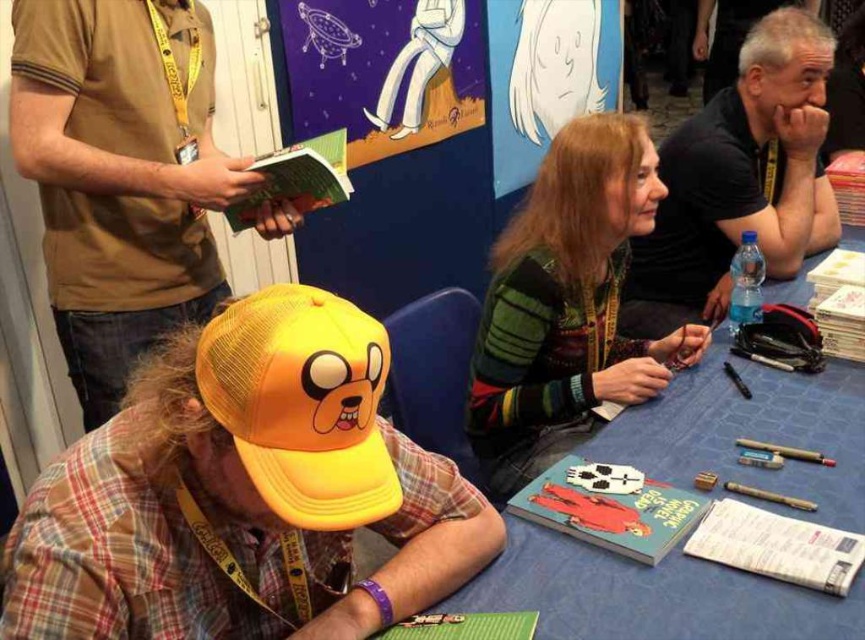
Looking at this image, which of these two, blue fabric table at center or matte plastic book at center, stands taller?

With more height is blue fabric table at center.

Locate an element on the screen. This screenshot has height=640, width=865. blue fabric table at center is located at coordinates (650, 596).

Is yellow mesh cap at lower left above yellow mesh baseball cap at center?

Correct, yellow mesh cap at lower left is located above yellow mesh baseball cap at center.

Is yellow mesh cap at lower left further to the viewer compared to yellow mesh baseball cap at center?

Yes, it is behind yellow mesh baseball cap at center.

Locate an element on the screen. yellow mesh cap at lower left is located at coordinates (120, 176).

You are a GUI agent. You are given a task and a screenshot of the screen. Output one action in this format:
    pyautogui.click(x=<x>, y=<y>)
    Task: Click on the yellow mesh cap at lower left
    This screenshot has width=865, height=640.
    Given the screenshot: What is the action you would take?
    pyautogui.click(x=120, y=176)

I want to click on green striped sweater at center, so click(567, 305).